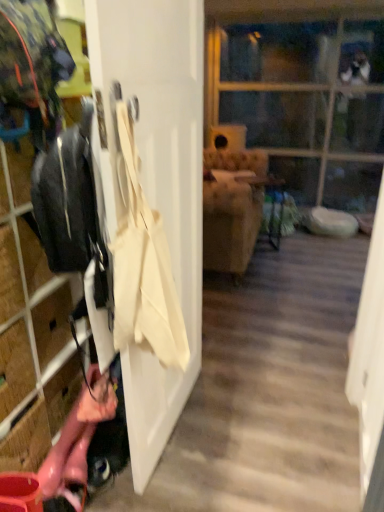
You are a GUI agent. You are given a task and a screenshot of the screen. Output one action in this format:
    pyautogui.click(x=<x>, y=<y>)
    Task: Click on the transparent plastic screen door at right
    The height and width of the screenshot is (512, 384).
    Given the screenshot: What is the action you would take?
    pyautogui.click(x=370, y=367)

At what (x,y) coordinates should I click in order to perform the action: click on white matte door at center. Please return your answer as a coordinate pair (x, y). Looking at the image, I should click on (156, 183).

Is white matte door at center turned away from transparent glass door at upper center?

No.

Does white matte door at center lie in front of transparent glass door at upper center?

That is True.

Which is closer, (181, 248) or (275, 154)?

Point (181, 248) is positioned closer to the camera compared to point (275, 154).

Would you say white matte door at center is to the left or to the right of transparent glass door at upper center in the picture?

Clearly, white matte door at center is on the left of transparent glass door at upper center in the image.

Looking at this image, is transparent plastic screen door at right further to the viewer compared to matte black jacket at left?

No, transparent plastic screen door at right is closer to the viewer.

Which of these two, transparent plastic screen door at right or matte black jacket at left, is thinner?

Thinner between the two is transparent plastic screen door at right.

What's the angular difference between transparent plastic screen door at right and matte black jacket at left's facing directions?

The angular difference between transparent plastic screen door at right and matte black jacket at left is 180 degrees.

From their relative heights in the image, would you say transparent plastic screen door at right is taller or shorter than matte black jacket at left?

transparent plastic screen door at right is shorter than matte black jacket at left.

From a real-world perspective, is matte black jacket at left over transparent plastic screen door at right?

Yes, from a real-world perspective, matte black jacket at left is above transparent plastic screen door at right.

Which object is positioned more to the left, matte black jacket at left or transparent plastic screen door at right?

From the viewer's perspective, matte black jacket at left appears more on the left side.

Does matte black jacket at left lie in front of transparent plastic screen door at right?

No.

Based on the photo, how many degrees apart are the facing directions of white matte door at center and matte black jacket at left?

The facing directions of white matte door at center and matte black jacket at left are 1.27 degrees apart.

Does white matte door at center have a greater height compared to matte black jacket at left?

Indeed, white matte door at center has a greater height compared to matte black jacket at left.

Is matte black jacket at left located within white matte door at center?

No, white matte door at center does not contain matte black jacket at left.

Where is `closet behind the white matte door at center`? This screenshot has height=512, width=384. closet behind the white matte door at center is located at coordinates (26, 201).

Which is less distant, (x=29, y=172) or (x=187, y=61)?

Point (x=29, y=172) is positioned closer to the camera compared to point (x=187, y=61).

Who is smaller, matte black jacket at left or white matte door at center?

white matte door at center is smaller.

Is matte black jacket at left located outside white matte door at center?

Yes, matte black jacket at left is located beyond the bounds of white matte door at center.

In the image, there is a matte black jacket at left. At what (x,y) coordinates should I click in order to perform the action: click on door above it (from the image's perspective). Please return your answer as a coordinate pair (x, y). Looking at the image, I should click on (156, 183).

From a real-world perspective, is transparent glass door at upper center on top of white matte door at center?

Yes.

Considering the relative sizes of transparent glass door at upper center and white matte door at center in the image provided, is transparent glass door at upper center bigger than white matte door at center?

Yes.

From the image's perspective, which object appears higher, transparent glass door at upper center or white matte door at center?

transparent glass door at upper center.

Which of these two, transparent glass door at upper center or transparent plastic screen door at right, is thinner?

Thinner between the two is transparent plastic screen door at right.

Does point (305, 124) come farther from viewer compared to point (357, 388)?

That is True.

Is transparent glass door at upper center behind transparent plastic screen door at right?

Yes, transparent glass door at upper center is further from the viewer.

Image resolution: width=384 pixels, height=512 pixels. Find the location of `glass door above the white matte door at center (from a real-world perspective)`. glass door above the white matte door at center (from a real-world perspective) is located at coordinates (304, 96).

The height and width of the screenshot is (512, 384). I want to click on closet lying above the transparent plastic screen door at right (from the image's perspective), so click(26, 201).

Looking at this image, estimate the real-world distances between objects in this image. Which object is further from matte black jacket at left, beige canvas tote at left or transparent plastic screen door at right?

transparent plastic screen door at right is further to matte black jacket at left.

Based on the photo, based on their spatial positions, is transparent glass door at upper center or transparent plastic screen door at right closer to white matte door at center?

transparent plastic screen door at right lies closer to white matte door at center than the other object.

Looking at the image, which one is located closer to white matte door at center, beige canvas tote at left or transparent plastic screen door at right?

beige canvas tote at left.

Based on their spatial positions, is transparent plastic screen door at right or white matte door at center closer to transparent glass door at upper center?

Among the two, transparent plastic screen door at right is located nearer to transparent glass door at upper center.

When comparing their distances from matte black jacket at left, does transparent glass door at upper center or transparent plastic screen door at right seem closer?

transparent plastic screen door at right is closer to matte black jacket at left.

Based on their spatial positions, is white matte door at center or transparent plastic screen door at right closer to beige canvas tote at left?

white matte door at center is positioned closer to the anchor beige canvas tote at left.

From the image, which object appears to be nearer to white matte door at center, matte black jacket at left or transparent glass door at upper center?

The object closer to white matte door at center is matte black jacket at left.

Estimate the real-world distances between objects in this image. Which object is closer to white matte door at center, beige canvas tote at left or matte black jacket at left?

Among the two, beige canvas tote at left is located nearer to white matte door at center.

Identify the location of closet between beige canvas tote at left and transparent glass door at upper center in the front-back direction. The height and width of the screenshot is (512, 384). (26, 201).

Image resolution: width=384 pixels, height=512 pixels. I want to click on screen door positioned between white matte door at center and transparent glass door at upper center from near to far, so click(x=370, y=367).

Where is `door between beige canvas tote at left and transparent plastic screen door at right`? The height and width of the screenshot is (512, 384). door between beige canvas tote at left and transparent plastic screen door at right is located at coordinates pyautogui.click(x=156, y=183).

Identify the location of closet between transparent plastic screen door at right and transparent glass door at upper center in the front-back direction. (26, 201).